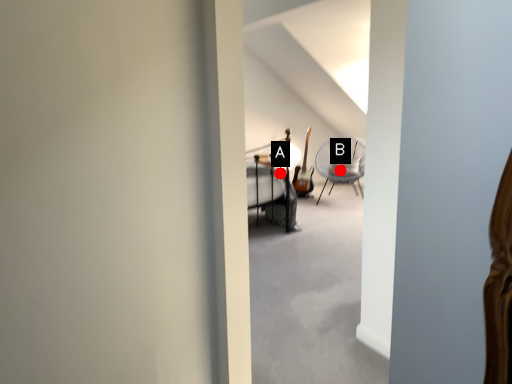
Question: Two points are circled on the image, labeled by A and B beside each circle. Which of the following is the farthest from the observer?

Choices:
 (A) A is further
 (B) B is further

Answer: (B)